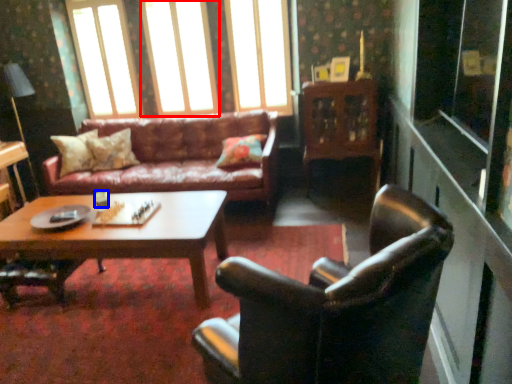
Question: Which object is closer to the camera taking this photo, window (highlighted by a red box) or coffee cup (highlighted by a blue box)?

Choices:
 (A) window
 (B) coffee cup

Answer: (B)